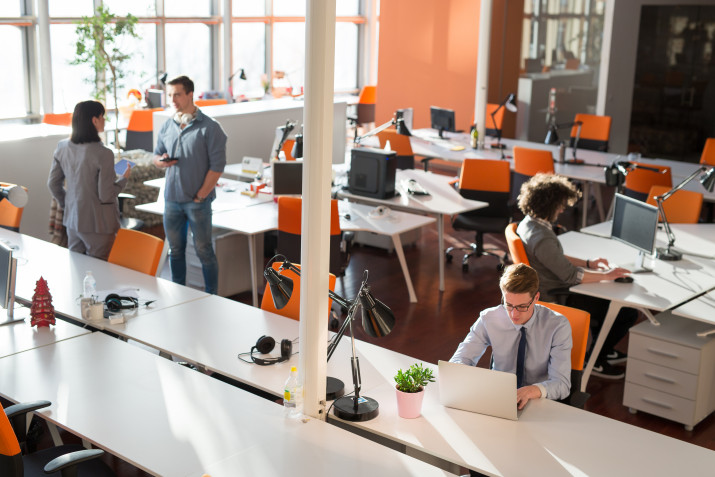
I want to click on computer monitor, so click(x=6, y=281), click(x=485, y=380), click(x=646, y=225), click(x=287, y=181), click(x=448, y=120), click(x=151, y=96).